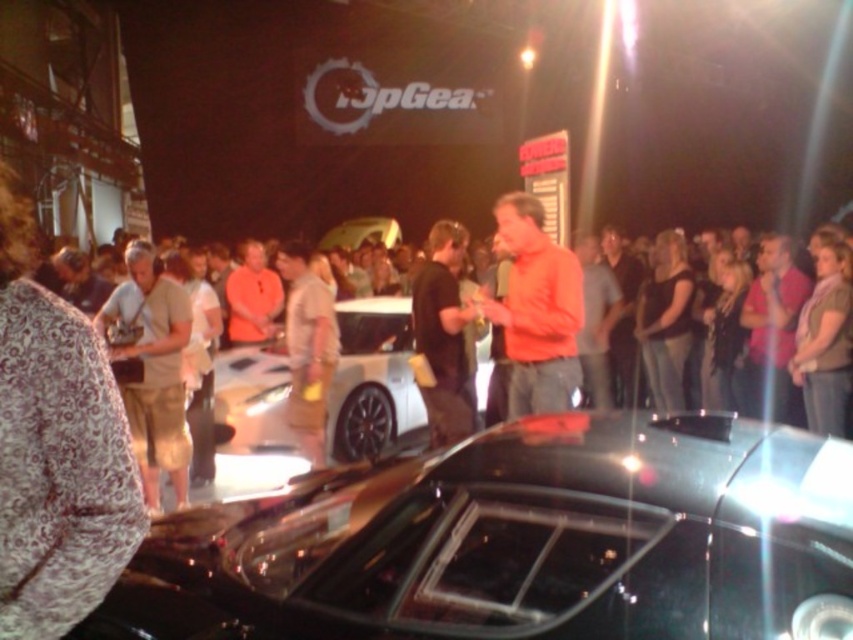
Question: Which point appears closest to the camera in this image?

Choices:
 (A) (535, 305)
 (B) (643, 360)
 (C) (248, 557)

Answer: (C)

Question: Does shiny black car at center have a smaller size compared to black fabric dress at center?

Choices:
 (A) no
 (B) yes

Answer: (A)

Question: Which of the following is the farthest from the observer?

Choices:
 (A) orange matte shirt at center
 (B) tan fabric shirt at left

Answer: (B)

Question: Does shiny black car at center have a smaller size compared to orange matte shirt at center?

Choices:
 (A) no
 (B) yes

Answer: (A)

Question: Which of the following is the closest to the observer?

Choices:
 (A) (469, 385)
 (B) (755, 522)

Answer: (B)

Question: Is black matte shirt at center to the left of black fabric dress at center from the viewer's perspective?

Choices:
 (A) yes
 (B) no

Answer: (A)